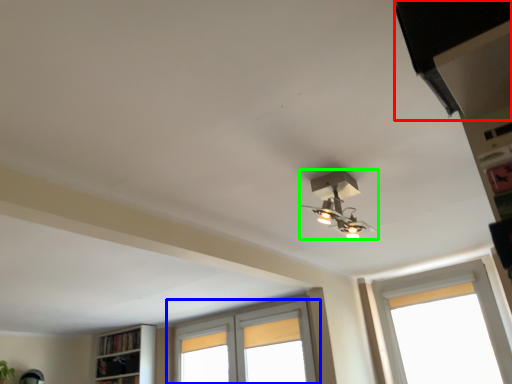
Question: Which object is the farthest from exhaust hood (highlighted by a red box)? Choose among these: window (highlighted by a blue box) or lamp (highlighted by a green box).

Choices:
 (A) window
 (B) lamp

Answer: (A)